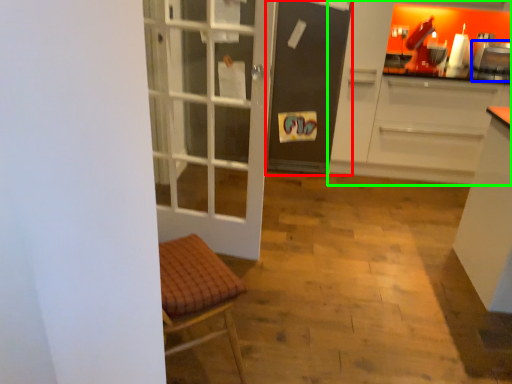
Question: Considering the real-world distances, which object is closest to screen door (highlighted by a red box)? appliance (highlighted by a blue box) or cabinetry (highlighted by a green box).

Choices:
 (A) appliance
 (B) cabinetry

Answer: (B)